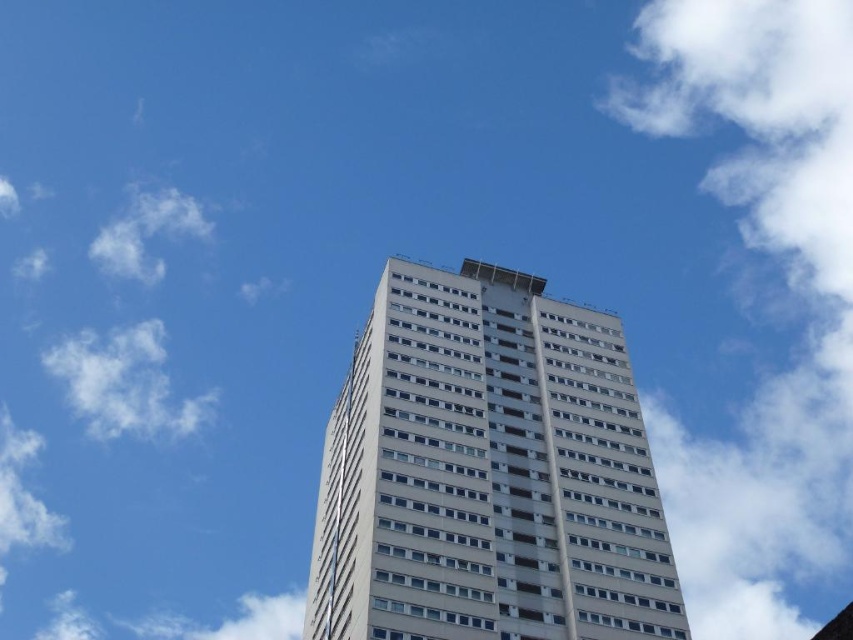
You are standing in front of the tall modern building and want to determine which of the two points, point (532, 307) or point (78, 380), is closer to you. Based on the scene, which point is nearer?

Point (532, 307) is closer to the viewer than point (78, 380).

You are an architect evaluating the design of the white smooth building at center. From the perspective shown in the image, how does its width compare to the white fluffy cloud at upper left?

The white smooth building at center is narrower than the white fluffy cloud at upper left because its width is less than that of the cloud.

You are standing at the base of the white smooth building at center and want to take a photo of its top. Given that your camera can capture a maximum vertical angle of 60 degrees, will you be able to capture the entire height of the building in one shot?

The white smooth building at center is located at point coordinates which require calculating the angle. Since the camera can only capture up to 60 degrees vertically, and without knowing the exact distance from the building, it is impossible to determine if the entire height can be captured. However, based on the perspective showing the building towering upwards with the sky dominating the upper frame, it is likely the angle exceeds 60 degrees, making it difficult to capture the entire height in one shot.